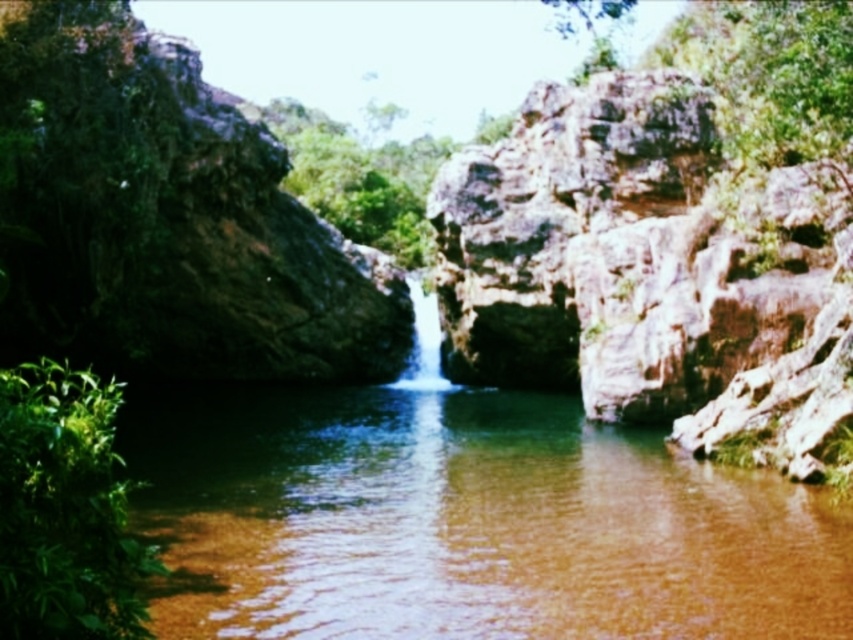
Question: Which point is farther to the camera?

Choices:
 (A) brown smooth river at center
 (B) white smooth waterfall at center

Answer: (B)

Question: Based on their relative distances, which object is farther from the green leafy plant at lower left?

Choices:
 (A) white smooth waterfall at center
 (B) brown smooth river at center

Answer: (A)

Question: Observing the image, what is the correct spatial positioning of brown smooth river at center in reference to white smooth waterfall at center?

Choices:
 (A) right
 (B) left

Answer: (B)

Question: Is green leafy plant at lower left wider than white smooth waterfall at center?

Choices:
 (A) yes
 (B) no

Answer: (A)

Question: Which object appears closest to the camera in this image?

Choices:
 (A) brown smooth river at center
 (B) green leafy plant at lower left
 (C) white smooth waterfall at center

Answer: (B)

Question: Can you confirm if brown smooth river at center is bigger than green leafy plant at lower left?

Choices:
 (A) no
 (B) yes

Answer: (B)